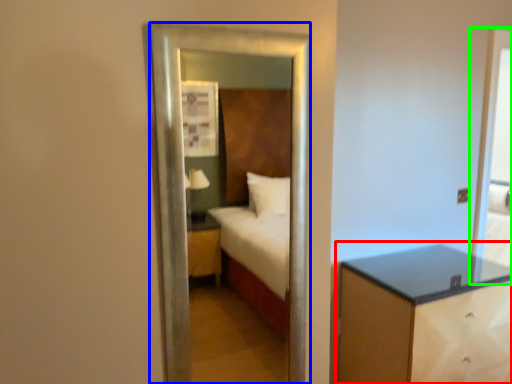
Question: Which is farther away from nightstand (highlighted by a red box)? mirror (highlighted by a blue box) or screen door (highlighted by a green box)?

Choices:
 (A) mirror
 (B) screen door

Answer: (A)